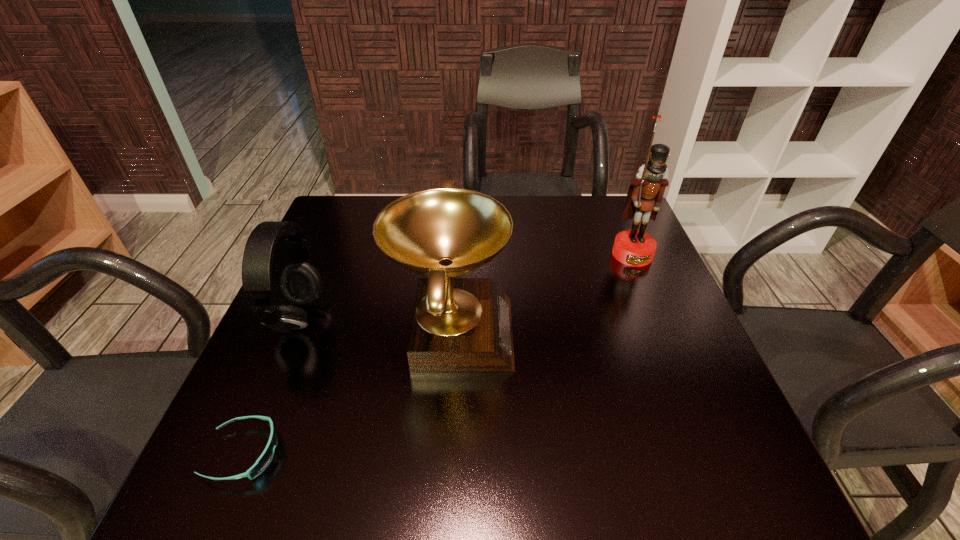
Locate an element on the screen. object at the far edge is located at coordinates (632, 247).

Where is `object located in the near edge section of the desktop`? The width and height of the screenshot is (960, 540). object located in the near edge section of the desktop is located at coordinates (x=263, y=461).

Where is `earphone positioned at the left edge`? The width and height of the screenshot is (960, 540). earphone positioned at the left edge is located at coordinates (301, 284).

Find the location of a particular element. sunglasses present at the left edge is located at coordinates (263, 461).

Locate an element on the screen. This screenshot has height=540, width=960. object positioned at the right edge is located at coordinates 632,247.

Locate an element on the screen. The width and height of the screenshot is (960, 540). object situated at the near left corner is located at coordinates (263, 461).

This screenshot has height=540, width=960. I want to click on object positioned at the far right corner, so click(x=632, y=247).

The image size is (960, 540). What are the coordinates of `vacant space at the far edge of the desktop` in the screenshot? It's located at point(556,208).

You are a GUI agent. You are given a task and a screenshot of the screen. Output one action in this format:
    pyautogui.click(x=<x>, y=<y>)
    Task: Click on the vacant space at the near edge
    
    Given the screenshot: What is the action you would take?
    pyautogui.click(x=449, y=453)

At what (x,y) coordinates should I click in order to perform the action: click on vacant area at the left edge of the desktop. Please return your answer as a coordinate pair (x, y). The image size is (960, 540). Looking at the image, I should click on (351, 303).